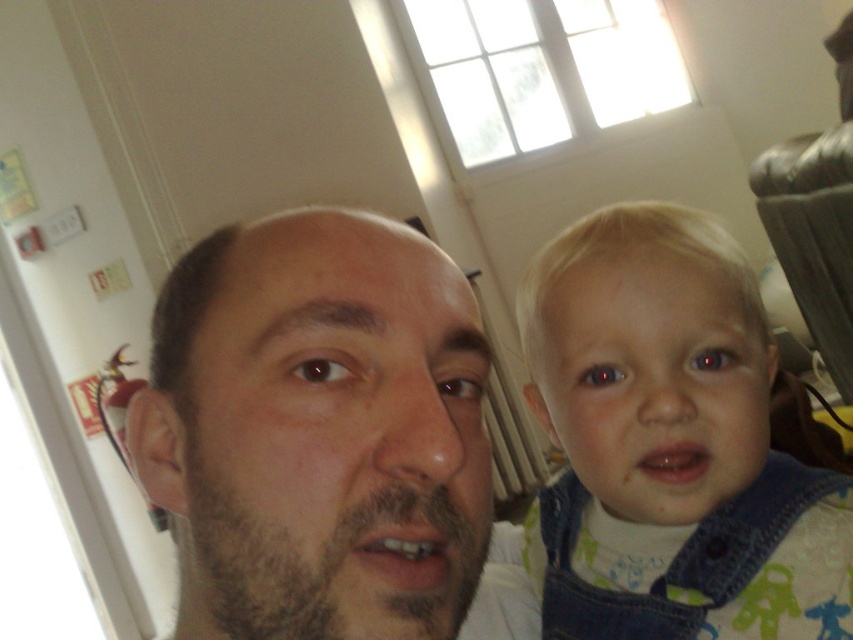
From the picture: You are taking a photo of two people in a room with a window. You notice a smooth skin face at center and denim overalls at right. Which object is nearer to you?

The smooth skin face at center is closer to the viewer than the denim overalls at right.

You are a photographer trying to capture a group photo of the smooth skin face at center and the denim overalls at right. The camera you are using has a minimum focusing distance of 6 inches. Can you take a clear photo of both subjects without moving them?

The distance between the smooth skin face at center and the denim overalls at right is 7.30 inches, which is greater than the camera minimum focusing distance of 6 inches. Therefore, the photographer can take a clear photo of both subjects without moving them.